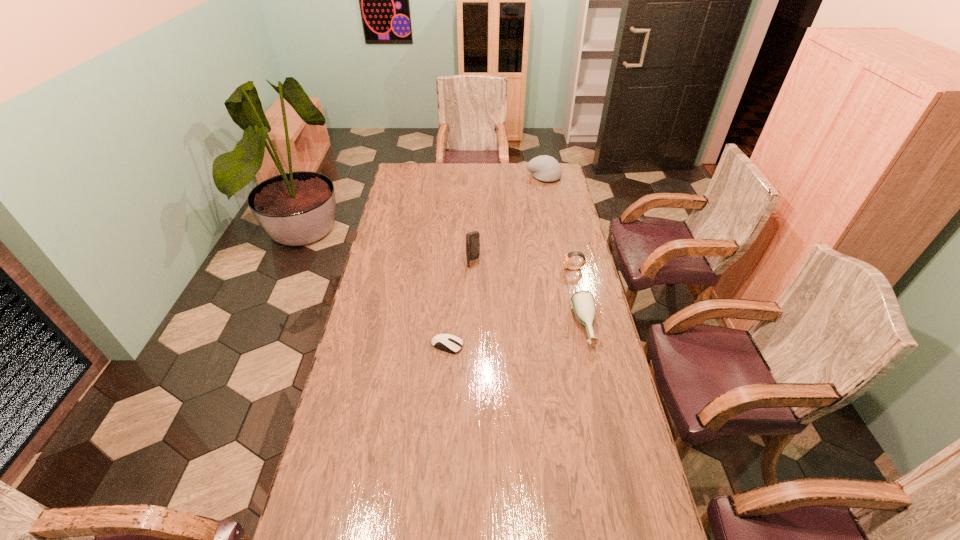
Find the location of a particular element. cellular telephone is located at coordinates (473, 238).

Identify the location of the tallest object. (x=473, y=238).

This screenshot has width=960, height=540. I want to click on beanie, so click(x=545, y=168).

Locate an element on the screen. This screenshot has width=960, height=540. the second tallest object is located at coordinates (545, 168).

The height and width of the screenshot is (540, 960). Identify the location of watch. (566, 258).

At what (x,y) coordinates should I click in order to perform the action: click on bottle. Please return your answer as a coordinate pair (x, y). Looking at the image, I should click on (583, 303).

Find the location of a particular element. Image resolution: width=960 pixels, height=540 pixels. the shortest object is located at coordinates (449, 343).

Where is `the leftmost object`? the leftmost object is located at coordinates (449, 343).

You are a GUI agent. You are given a task and a screenshot of the screen. Output one action in this format:
    pyautogui.click(x=<x>, y=<y>)
    Task: Click on the vacant space located on the keyboard of the fourth object from right to left
    
    Given the screenshot: What is the action you would take?
    pyautogui.click(x=543, y=262)

Where is `vacant region located on the left of the beanie`? Image resolution: width=960 pixels, height=540 pixels. vacant region located on the left of the beanie is located at coordinates (514, 177).